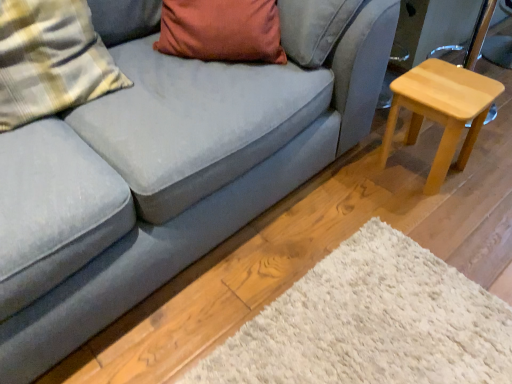
Question: From their relative heights in the image, would you say plaid fabric pillow at left is taller or shorter than light wood stool at right?

Choices:
 (A) short
 (B) tall

Answer: (B)

Question: From the image's perspective, relative to light wood stool at right, is plaid fabric pillow at left above or below?

Choices:
 (A) below
 (B) above

Answer: (B)

Question: In terms of width, does plaid fabric pillow at left look wider or thinner when compared to light wood stool at right?

Choices:
 (A) thin
 (B) wide

Answer: (A)

Question: Is light wood stool at right in front of or behind plaid fabric pillow at left in the image?

Choices:
 (A) front
 (B) behind

Answer: (B)

Question: Considering the positions of point (483, 89) and point (99, 57), is point (483, 89) closer or farther from the camera than point (99, 57)?

Choices:
 (A) farther
 (B) closer

Answer: (A)

Question: From the image's perspective, is light wood stool at right positioned above or below plaid fabric pillow at left?

Choices:
 (A) above
 (B) below

Answer: (B)

Question: From a real-world perspective, is light wood stool at right positioned above or below plaid fabric pillow at left?

Choices:
 (A) below
 (B) above

Answer: (A)